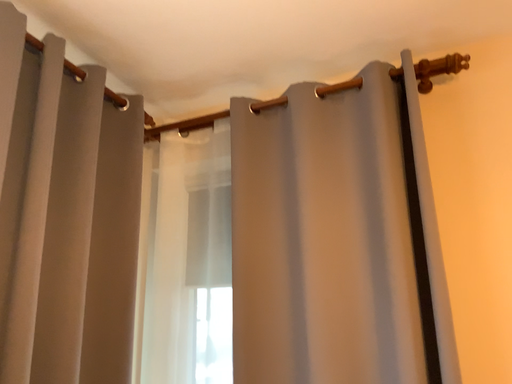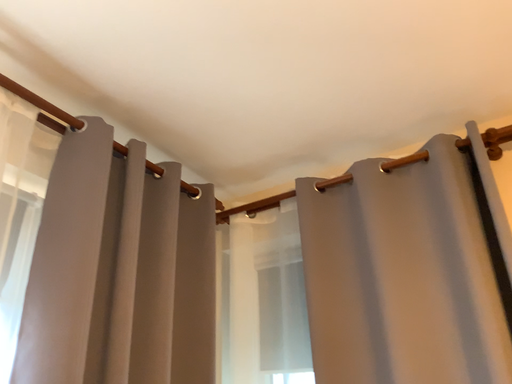
Question: Which way did the camera rotate in the video?

Choices:
 (A) rotated right
 (B) rotated left

Answer: (B)